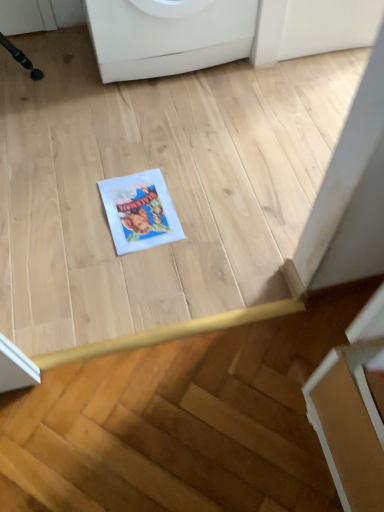
At what (x,y) coordinates should I click in order to perform the action: click on vacant region above white paper comic book at center (from a real-world perspective). Please return your answer as a coordinate pair (x, y). The height and width of the screenshot is (512, 384). Looking at the image, I should click on (141, 206).